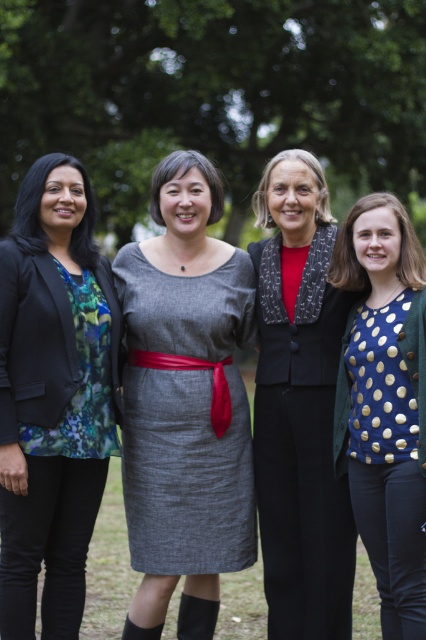
Is point (86, 387) positioned behind point (305, 211)?

No, (86, 387) is in front of (305, 211).

Measure the distance between point (94,468) and camera.

Point (94,468) is 6.03 meters from camera.

Does point (72, 342) lie behind point (333, 625)?

No.

Identify the location of matte black blazer at left. (51, 397).

Can you confirm if matte black blazer at left is positioned to the right of gray woolen dress at center?

In fact, matte black blazer at left is to the left of gray woolen dress at center.

Find the location of a particular element. This screenshot has height=640, width=426. matte black blazer at left is located at coordinates (51, 397).

Does matte black blazer at center appear on the right side of blue dotted shirt at right?

No, matte black blazer at center is not to the right of blue dotted shirt at right.

Does matte black blazer at center have a lesser width compared to blue dotted shirt at right?

No.

I want to click on matte black blazer at center, so click(x=299, y=406).